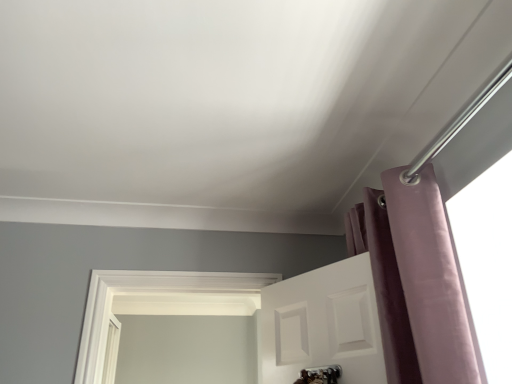
Describe the element at coordinates (414, 281) in the screenshot. I see `purple velvet curtain at upper right` at that location.

What is the approximate width of purple velvet curtain at upper right?

19.20 centimeters.

At what (x,y) coordinates should I click in order to perform the action: click on purple velvet curtain at upper right. Please return your answer as a coordinate pair (x, y). This screenshot has height=384, width=512. Looking at the image, I should click on (414, 281).

In order to face purple velvet curtain at upper right, should I rotate leftwards or rightwards?

A 19.214 degree turn to the right will do.

At what (x,y) coordinates should I click in order to perform the action: click on purple velvet curtain at upper right. Please return your answer as a coordinate pair (x, y). This screenshot has height=384, width=512. Looking at the image, I should click on (414, 281).